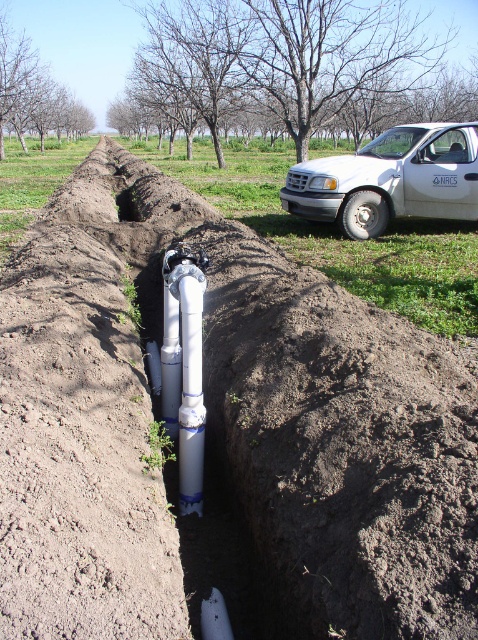
Between white matte truck at upper right and smooth concrete hole at center, which one appears on the right side from the viewer's perspective?

white matte truck at upper right

Can you confirm if white matte truck at upper right is thinner than smooth concrete hole at center?

In fact, white matte truck at upper right might be wider than smooth concrete hole at center.

Which is behind, point (414, 157) or point (126, 204)?

The point (126, 204) is behind.

The width and height of the screenshot is (478, 640). I want to click on white matte truck at upper right, so click(391, 179).

Is point (180, 461) more distant than point (121, 202)?

No, (180, 461) is in front of (121, 202).

Based on the photo, is white plastic water pipe at center above smooth concrete hole at center?

Actually, white plastic water pipe at center is below smooth concrete hole at center.

Measure the distance between point (174, 419) and camera.

Point (174, 419) and camera are 3.55 meters apart.

This screenshot has width=478, height=640. What are the coordinates of `white plastic water pipe at center` in the screenshot? It's located at (184, 365).

Does point (435, 154) come farther from viewer compared to point (174, 392)?

Yes, it is behind point (174, 392).

Locate an element on the screen. The height and width of the screenshot is (640, 478). white matte truck at upper right is located at coordinates click(x=391, y=179).

Who is more distant from viewer, (358, 225) or (182, 268)?

Point (358, 225)

Find the location of a particular element. The width and height of the screenshot is (478, 640). white matte truck at upper right is located at coordinates (391, 179).